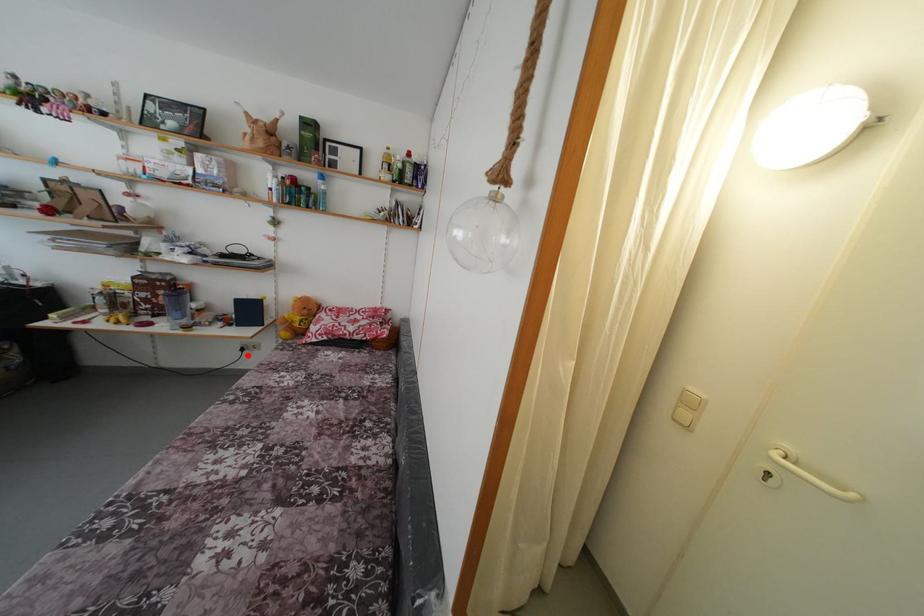
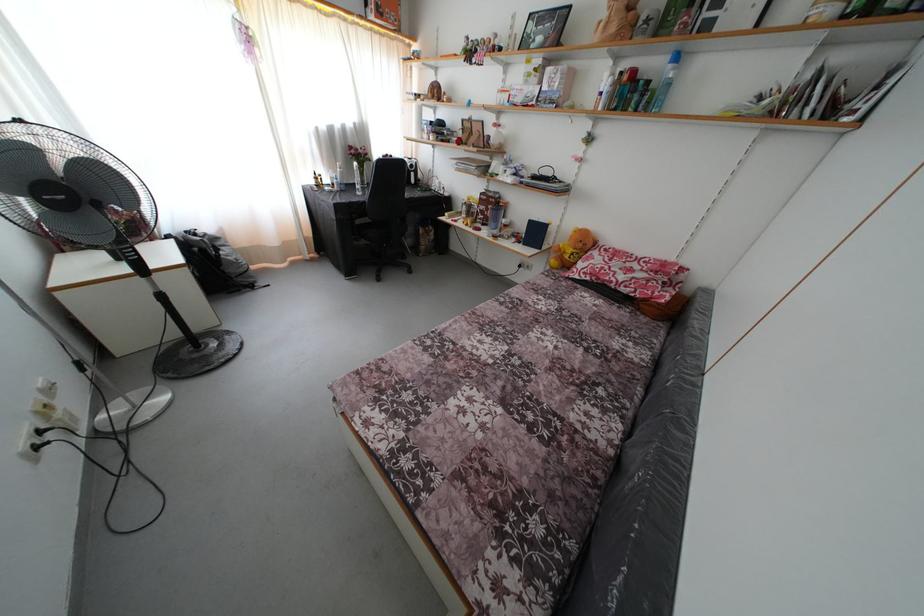
Question: I am providing you with two images of the same scene from different viewpoints. Image1 has a red point marked. In image2, the corresponding 3D location appears at what relative position? Reply with the corresponding letter.

Choices:
 (A) Closer
 (B) Farther

Answer: (A)